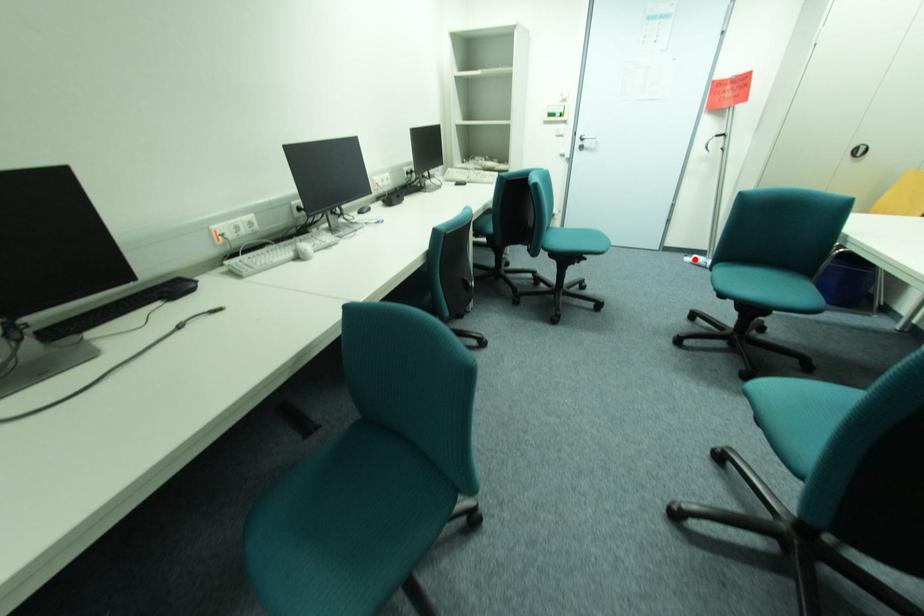
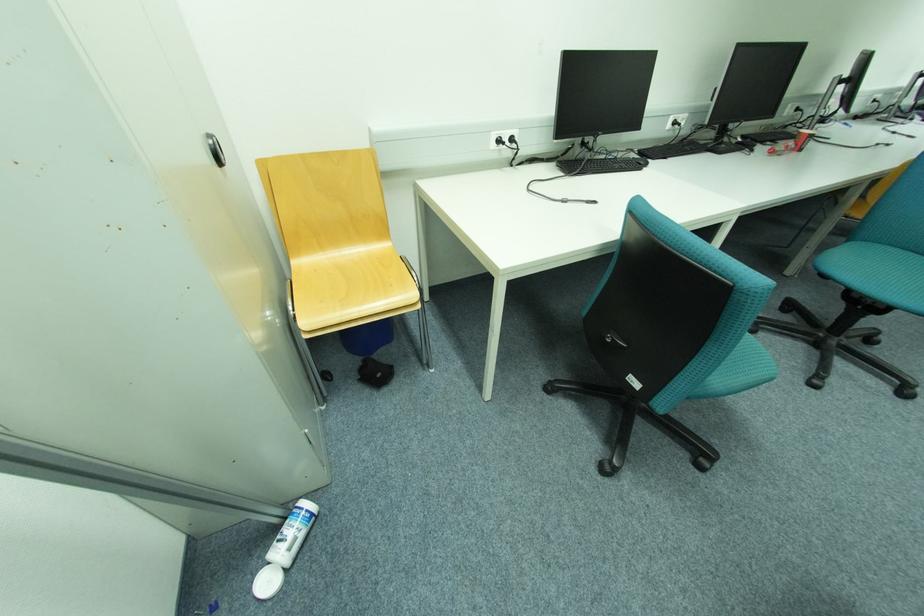
Question: I am providing you with two images of the same scene from different viewpoints. In image1, a red point is highlighted. Considering the same 3D point in image2, which of the following is correct?

Choices:
 (A) It is closer
 (B) It is farther

Answer: (A)